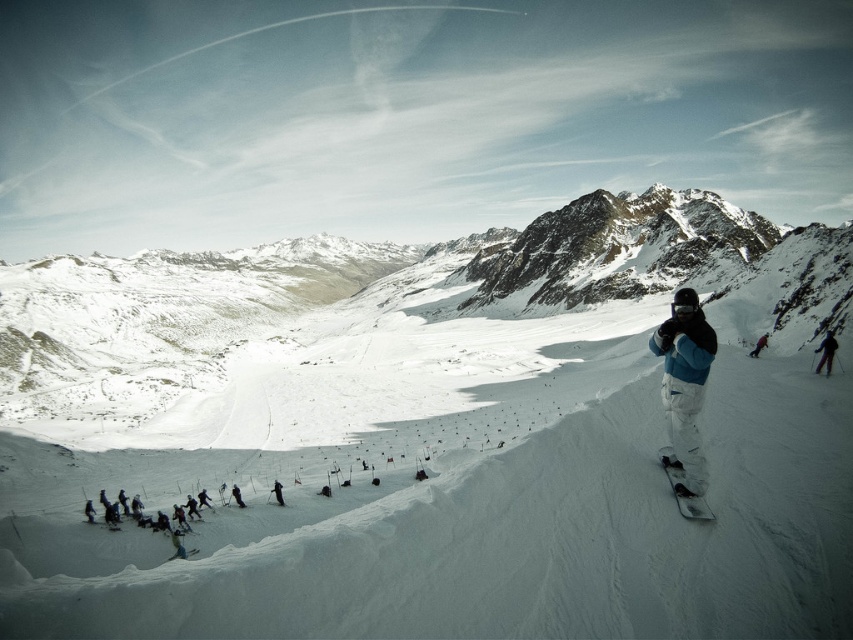
Is black matte snowboarder at right to the left of red snowboarder at center from the viewer's perspective?

Incorrect, black matte snowboarder at right is not on the left side of red snowboarder at center.

Does black matte snowboarder at right have a smaller size compared to red snowboarder at center?

Actually, black matte snowboarder at right might be larger than red snowboarder at center.

Is point (830, 355) closer to camera compared to point (764, 339)?

Yes, it is.

Find the location of `black matte snowboarder at right`. black matte snowboarder at right is located at coordinates 827,353.

From the picture: Is black matte snowboarder at right closer to the viewer compared to black ski suit at center?

Yes, it is.

Which is below, black matte snowboarder at right or black ski suit at center?

black ski suit at center

Locate an element on the screen. This screenshot has height=640, width=853. black matte snowboarder at right is located at coordinates (827, 353).

Identify the location of black matte snowboarder at right. This screenshot has height=640, width=853. [x=827, y=353].

Does blue denim pants at lower left have a greater width compared to black ski suit at center?

No.

Is the position of blue denim pants at lower left less distant than that of black ski suit at center?

Yes, blue denim pants at lower left is closer to the viewer.

Identify the location of blue denim pants at lower left. The width and height of the screenshot is (853, 640). (177, 545).

At what (x,y) coordinates should I click in order to perform the action: click on blue denim pants at lower left. Please return your answer as a coordinate pair (x, y). This screenshot has width=853, height=640. Looking at the image, I should click on (177, 545).